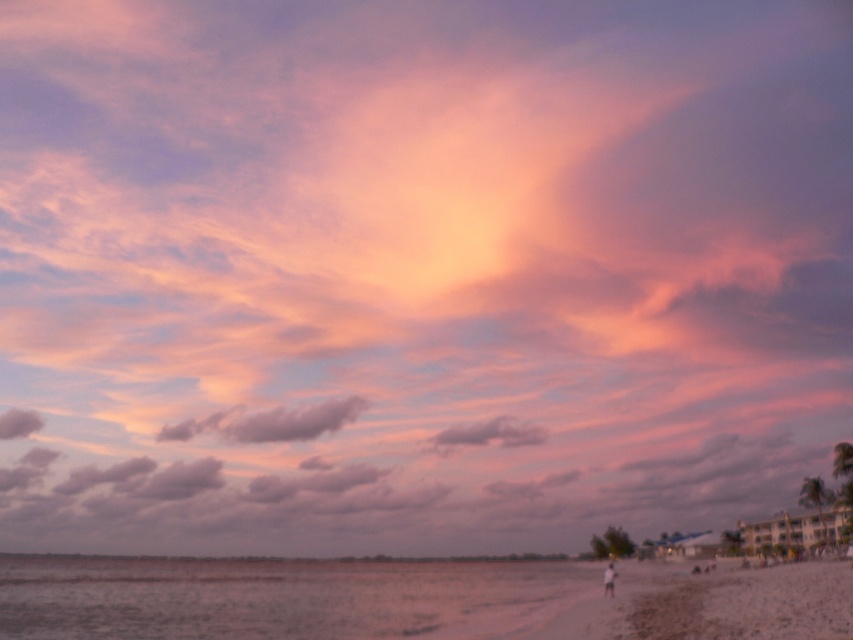
Between gray cotton cloud at upper left and blurred white figure at lower right, which one has more height?

blurred white figure at lower right is taller.

Does gray cotton cloud at upper left appear on the right side of blurred white figure at lower right?

In fact, gray cotton cloud at upper left is to the left of blurred white figure at lower right.

Locate an element on the screen. gray cotton cloud at upper left is located at coordinates (18, 422).

How far apart are white sandy beach at lower right and pink fluffy cloud at center?

They are 181.26 meters apart.

Can you confirm if white sandy beach at lower right is shorter than pink fluffy cloud at center?

In fact, white sandy beach at lower right may be taller than pink fluffy cloud at center.

Is point (840, 563) behind point (444, 451)?

No, (840, 563) is in front of (444, 451).

Image resolution: width=853 pixels, height=640 pixels. Find the location of `white sandy beach at lower right`. white sandy beach at lower right is located at coordinates (747, 604).

Can you confirm if purple cotton cloud at center is wider than gray cotton cloud at upper left?

Yes.

Who is more forward, (239, 424) or (15, 410)?

Positioned in front is point (239, 424).

This screenshot has width=853, height=640. In order to click on purple cotton cloud at center in this screenshot , I will do `click(270, 422)`.